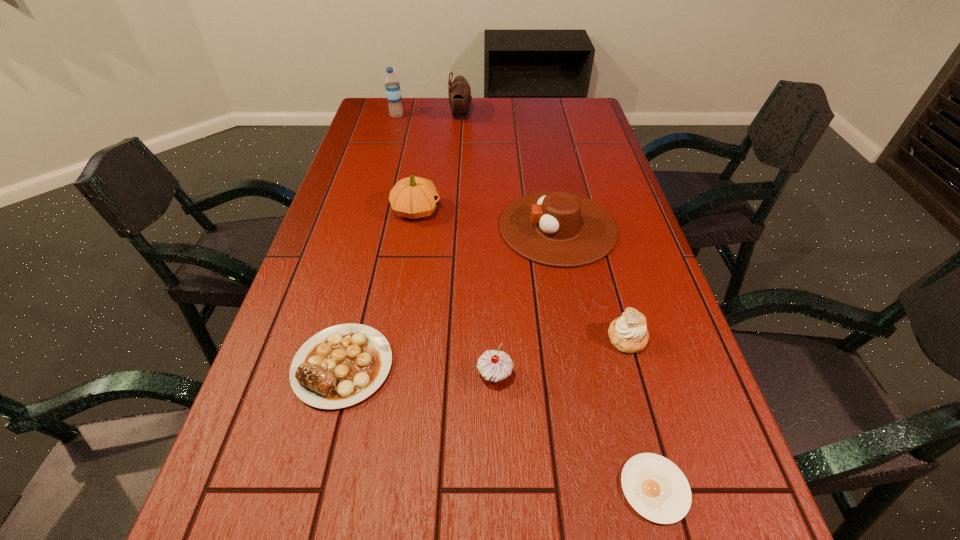
Locate an element on the screen. free spot located with the flap open on the second tallest object is located at coordinates (554, 115).

Find the location of a particular element. The image size is (960, 540). free space located on the side of the gourd with the carved face is located at coordinates (570, 211).

I want to click on vacant region located on the right of the cupcake, so click(x=632, y=376).

This screenshot has height=540, width=960. In order to click on vacant space located 0.390m on the front-facing side of the cowboy hat in this screenshot , I will do `click(358, 227)`.

At what (x,y) coordinates should I click in order to perform the action: click on vacant space situated 0.270m on the front-facing side of the cowboy hat. Please return your answer as a coordinate pair (x, y). Looking at the image, I should click on (401, 227).

Where is `free space located 0.080m on the front-facing side of the cowboy hat`? free space located 0.080m on the front-facing side of the cowboy hat is located at coordinates (470, 227).

Where is `vacant area situated 0.260m on the back of the third shortest object`? vacant area situated 0.260m on the back of the third shortest object is located at coordinates (600, 244).

Locate an element on the screen. This screenshot has width=960, height=540. vacant space located on the back of the steak is located at coordinates (380, 217).

Find the location of a particular element. vacant space located on the right of the egg yolk is located at coordinates (718, 488).

You are a GUI agent. You are given a task and a screenshot of the screen. Output one action in this format:
    pyautogui.click(x=<x>, y=<y>)
    Task: Click on the water bottle situated at the far edge
    The width and height of the screenshot is (960, 540).
    Given the screenshot: What is the action you would take?
    pyautogui.click(x=392, y=87)